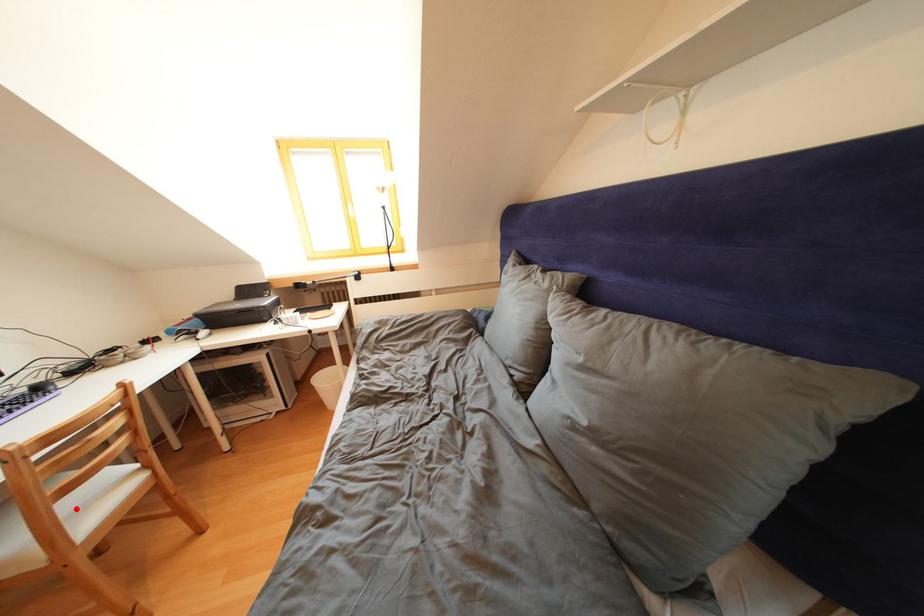
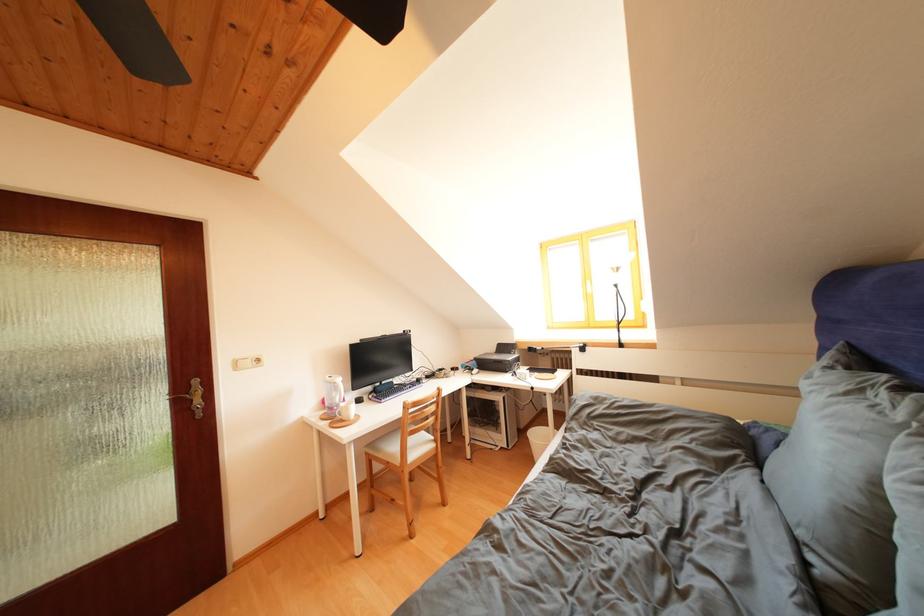
Question: I am providing you with two images of the same scene from different viewpoints. In image1, a red point is highlighted. Considering the same 3D point in image2, which of the following is correct?

Choices:
 (A) It is closer
 (B) It is farther

Answer: (B)